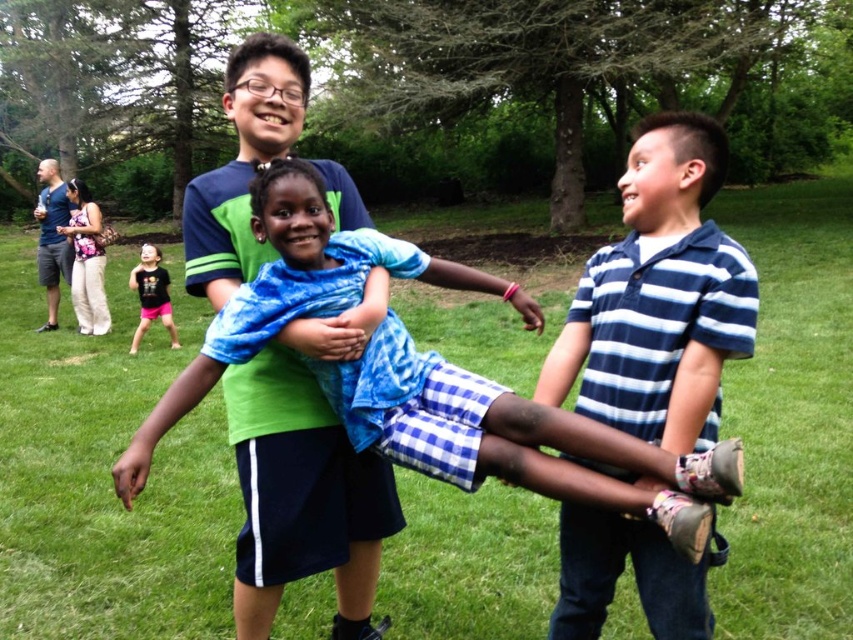
The width and height of the screenshot is (853, 640). What do you see at coordinates (306, 477) in the screenshot? I see `green cotton shirt at center` at bounding box center [306, 477].

Who is positioned more to the left, green cotton shirt at center or black t-shirt at lower left?

Positioned to the left is black t-shirt at lower left.

Who is more distant from viewer, [322,337] or [149,244]?

Positioned behind is point [149,244].

Find the location of a particular element. This screenshot has width=853, height=640. green cotton shirt at center is located at coordinates (306, 477).

Measure the distance between blue tie-dye shirt at center and camera.

blue tie-dye shirt at center and camera are 1.56 meters apart.

Looking at this image, is blue tie-dye shirt at center to the left of black t-shirt at lower left from the viewer's perspective?

In fact, blue tie-dye shirt at center is to the right of black t-shirt at lower left.

Locate an element on the screen. The height and width of the screenshot is (640, 853). blue tie-dye shirt at center is located at coordinates (514, 438).

Where is `blue tie-dye shirt at center`? The image size is (853, 640). blue tie-dye shirt at center is located at coordinates (514, 438).

Which of these two, blue denim shorts at left or black t-shirt at lower left, stands shorter?

black t-shirt at lower left

Who is taller, blue denim shorts at left or black t-shirt at lower left?

blue denim shorts at left

Where is `blue denim shorts at left`? This screenshot has height=640, width=853. blue denim shorts at left is located at coordinates (51, 237).